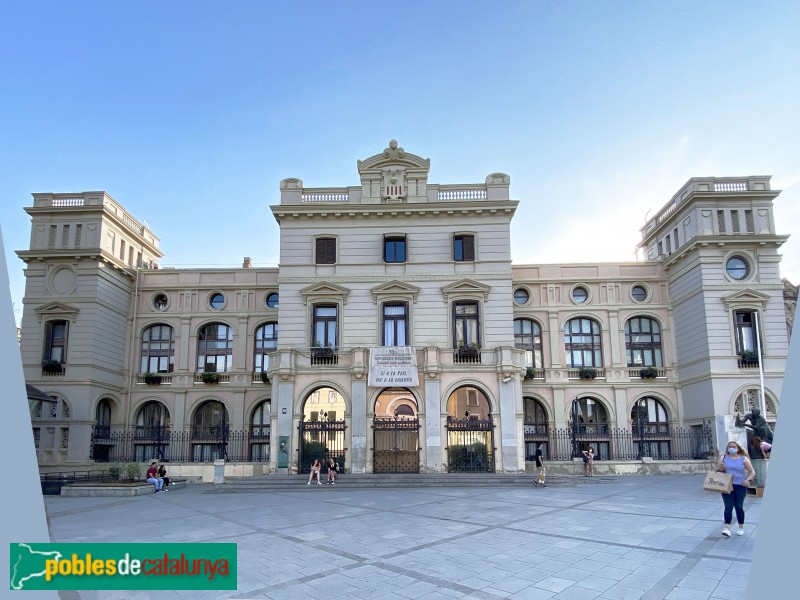
Find the location of `door`. door is located at coordinates (458, 450), (422, 430).